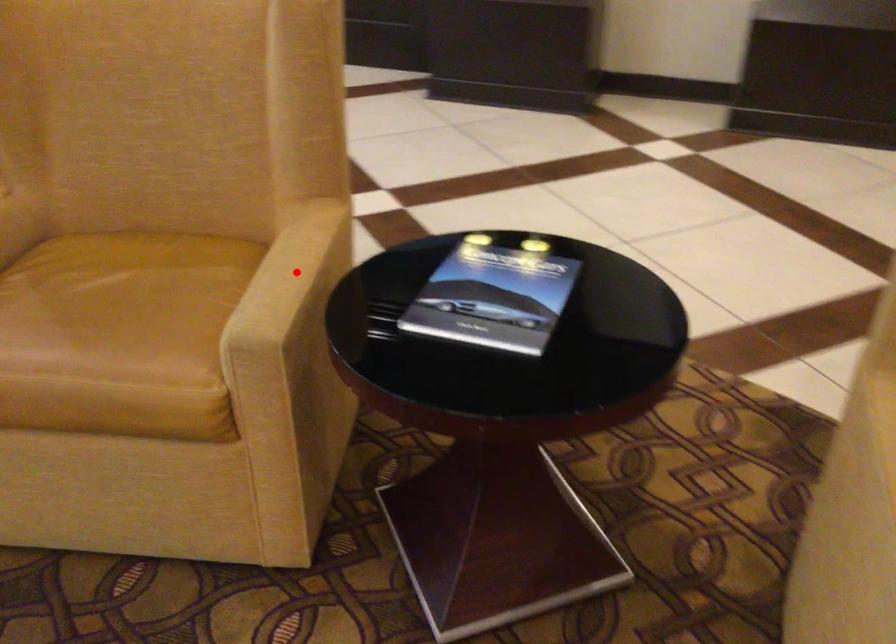
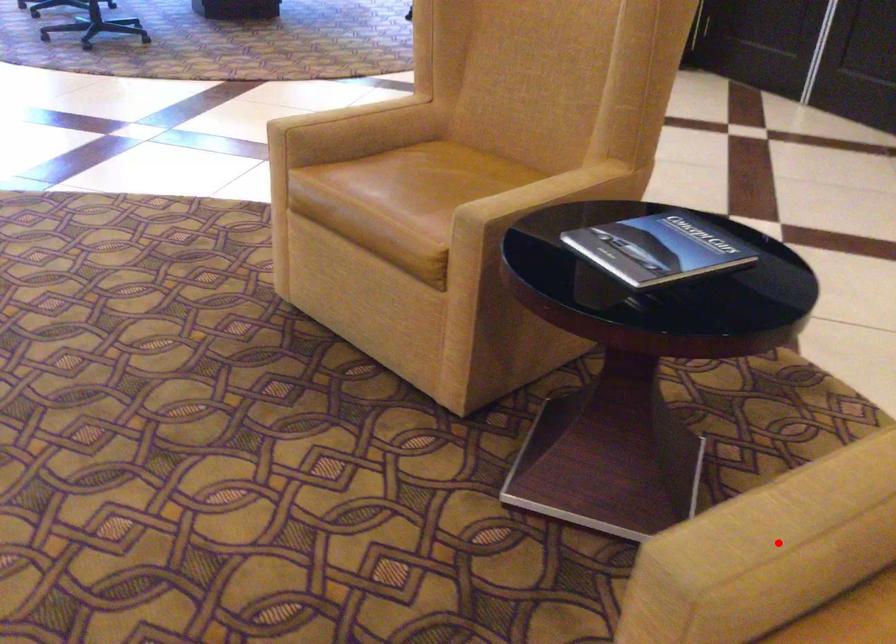
I am providing you with two images of the same scene from different viewpoints. A red point is marked on the first image and another point is marked on the second image. Does the point marked in image1 correspond to the same location as the one in image2?

No